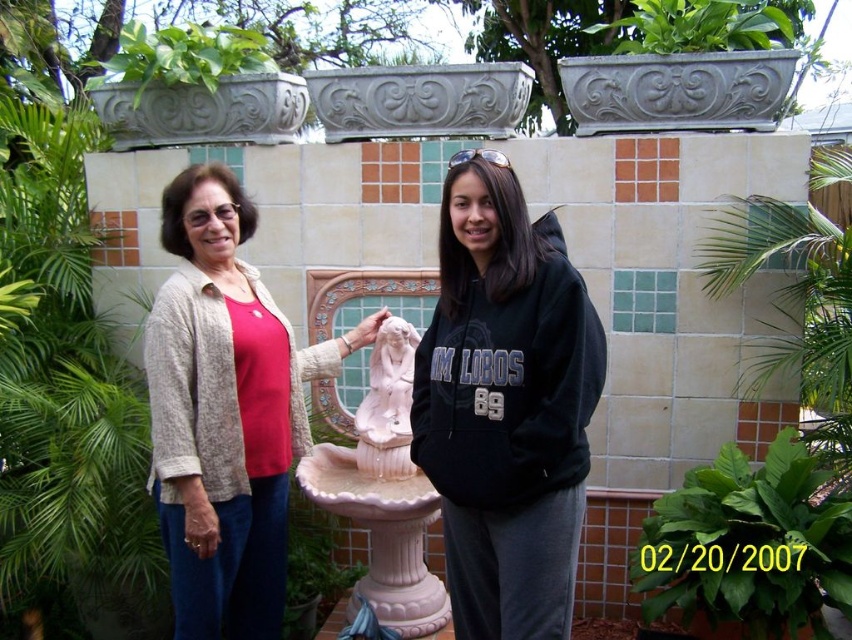
Does black fleece sweatshirt at center have a greater width compared to white marble statue at center?

Yes.

Does black fleece sweatshirt at center have a lesser height compared to white marble statue at center?

Incorrect, black fleece sweatshirt at center's height does not fall short of white marble statue at center's.

Locate an element on the screen. black fleece sweatshirt at center is located at coordinates (505, 404).

Looking at this image, is green leafy plant at lower right thinner than green leafy plant at upper left?

Yes.

Between green leafy plant at lower right and green leafy plant at upper left, which one has more height?

Standing taller between the two is green leafy plant at lower right.

The height and width of the screenshot is (640, 852). I want to click on green leafy plant at lower right, so click(747, 545).

Is black fleece sweatshirt at center thinner than matte beige cardigan at left?

Yes.

How far apart are black fleece sweatshirt at center and matte beige cardigan at left?

black fleece sweatshirt at center and matte beige cardigan at left are 3.53 feet apart.

This screenshot has height=640, width=852. Find the location of `black fleece sweatshirt at center`. black fleece sweatshirt at center is located at coordinates (505, 404).

This screenshot has height=640, width=852. I want to click on black fleece sweatshirt at center, so click(505, 404).